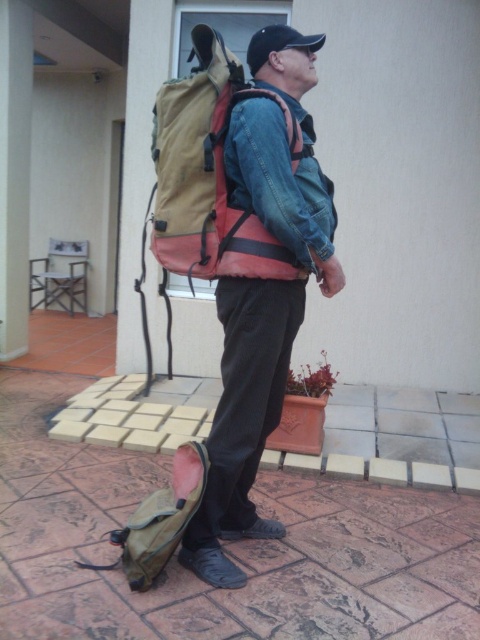
You are a photographer planning to capture the scene with the matte khaki backpack at lower left and the leather at lower center. Which object will appear larger in the photo?

The matte khaki backpack at lower left is much taller than the leather at lower center, so it will appear larger in the photo.

The man is wearing a denim jacket at center and has a matte khaki backpack at center. From the perspective of someone facing the man, which item is positioned to the left?

The matte khaki backpack at center is to the left of the denim jacket at center, so from the observer facing the man, the backpack is on the left side.